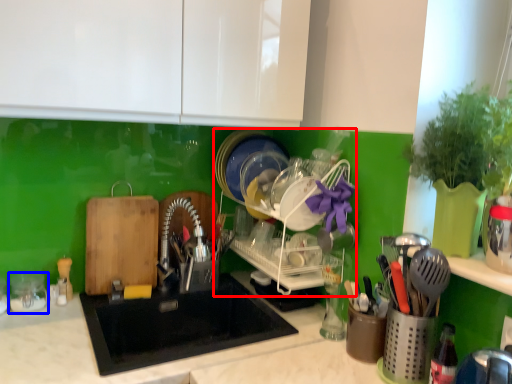
Question: Among these objects, which one is nearest to the camera, dish washer (highlighted by a red box) or tableware (highlighted by a blue box)?

Choices:
 (A) dish washer
 (B) tableware

Answer: (A)